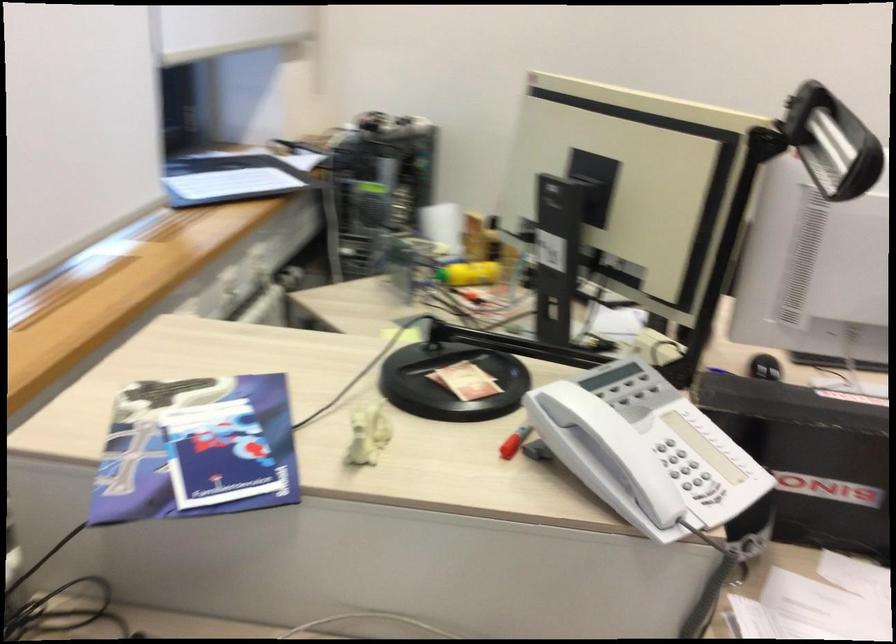
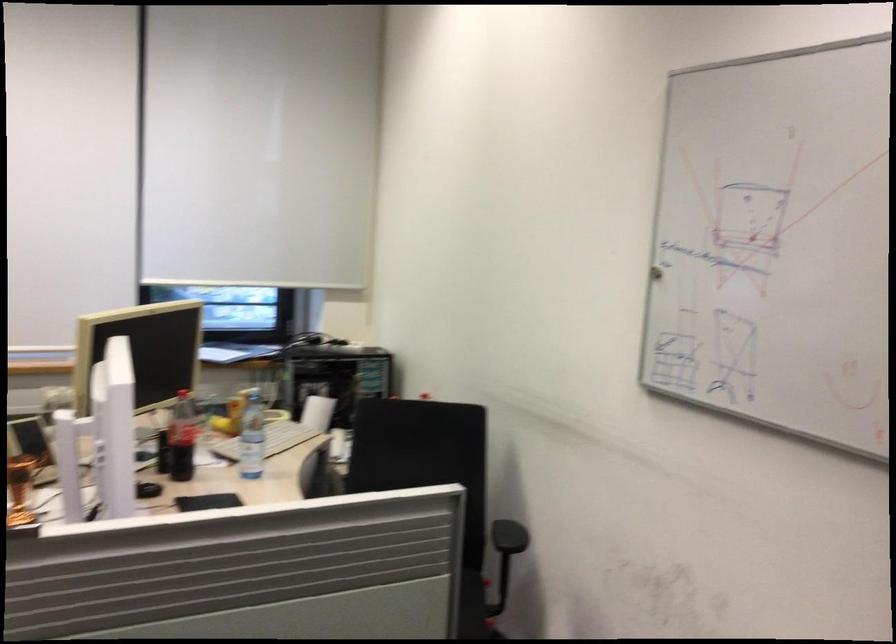
In the second image, find the point that corresponds to pixel 769 440 in the first image.

(20, 489)